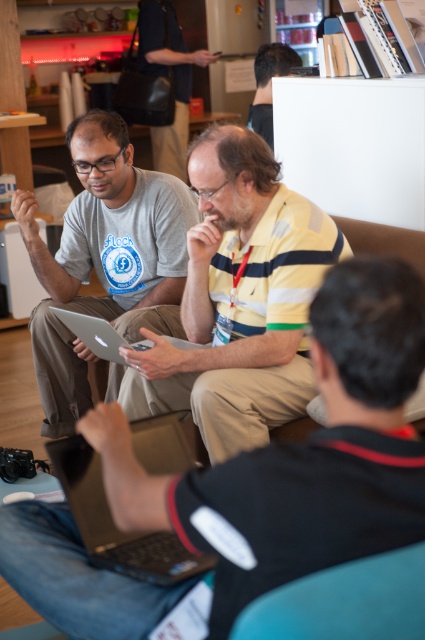
You are standing in the room and want to locate the yellow striped shirt at center. What are the coordinates where you can find it?

The yellow striped shirt at center can be found at coordinates point (238, 300).

You are standing in the room and want to place a new metallic silver laptop at lower center. Where should you put it so that it aligns with the existing point at coordinates (115, 524)?

The metallic silver laptop at lower center should be placed exactly at the coordinates (115, 524) to align with the existing point.

You are organizing a small event and need to place a decorative item on a shelf. The shelf has limited space. Given the objects in the scene, which one between the matte black bag at upper center and the black matte hair at upper center would you choose to fit on the shelf without exceeding the shelf width?

The black matte hair at upper center would fit better on the shelf since its width is smaller than the matte black bag at upper center, which is wider and might not fit within the limited space.